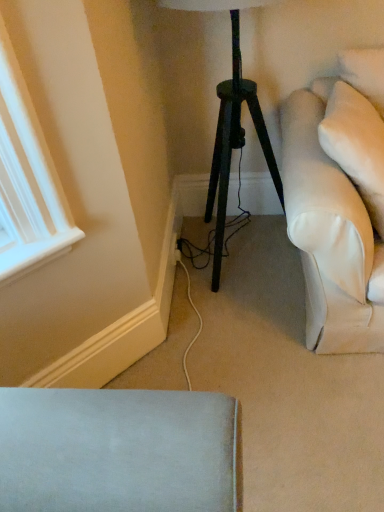
What are the coordinates of `white plastic electric outlet at lower center` in the screenshot? It's located at (174, 250).

What do you see at coordinates (174, 250) in the screenshot?
I see `white plastic electric outlet at lower center` at bounding box center [174, 250].

In order to click on white plastic electric outlet at lower center in this screenshot , I will do `click(174, 250)`.